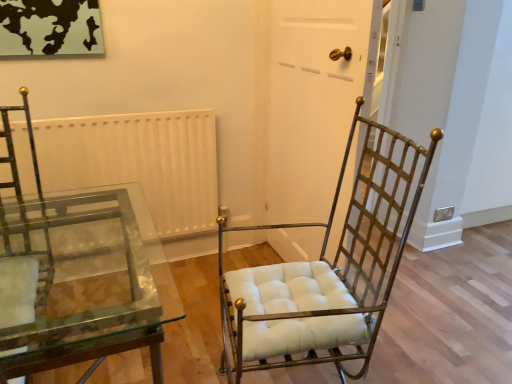
Question: Can gold metal/texture chair at center be found inside transparent glass table at lower left?

Choices:
 (A) no
 (B) yes

Answer: (A)

Question: Is transparent glass table at lower left smaller than gold metal/texture chair at center?

Choices:
 (A) yes
 (B) no

Answer: (B)

Question: From a real-world perspective, is transparent glass table at lower left over gold metal/texture chair at center?

Choices:
 (A) yes
 (B) no

Answer: (B)

Question: Is the position of transparent glass table at lower left more distant than that of gold metal/texture chair at center?

Choices:
 (A) yes
 (B) no

Answer: (B)

Question: From a real-world perspective, is transparent glass table at lower left positioned under gold metal/texture chair at center based on gravity?

Choices:
 (A) yes
 (B) no

Answer: (A)

Question: Is transparent glass table at lower left positioned with its back to gold metal/texture chair at center?

Choices:
 (A) yes
 (B) no

Answer: (B)

Question: Is gold metal/texture chair at center thinner than white matte radiator at upper center?

Choices:
 (A) no
 (B) yes

Answer: (A)

Question: Considering the relative sizes of gold metal/texture chair at center and white matte radiator at upper center in the image provided, is gold metal/texture chair at center bigger than white matte radiator at upper center?

Choices:
 (A) yes
 (B) no

Answer: (A)

Question: Considering the relative positions of gold metal/texture chair at center and white matte radiator at upper center in the image provided, is gold metal/texture chair at center behind white matte radiator at upper center?

Choices:
 (A) yes
 (B) no

Answer: (B)

Question: Is gold metal/texture chair at center not inside white matte radiator at upper center?

Choices:
 (A) no
 (B) yes

Answer: (B)

Question: Can you confirm if gold metal/texture chair at center is wider than white matte radiator at upper center?

Choices:
 (A) yes
 (B) no

Answer: (A)

Question: Is gold metal/texture chair at center positioned with its back to white matte radiator at upper center?

Choices:
 (A) no
 (B) yes

Answer: (A)

Question: From a real-world perspective, is white matte radiator at upper center physically below white matte door at center?

Choices:
 (A) no
 (B) yes

Answer: (B)